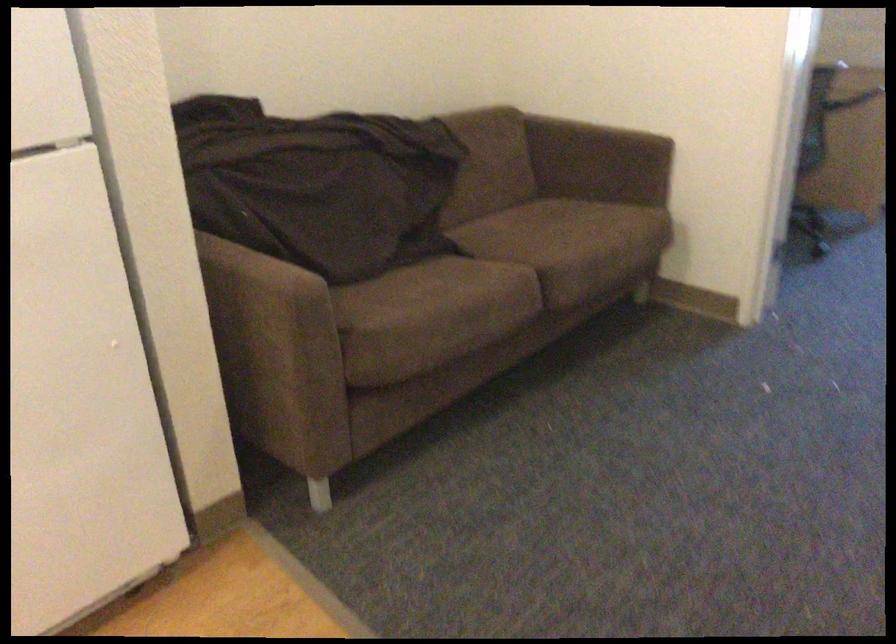
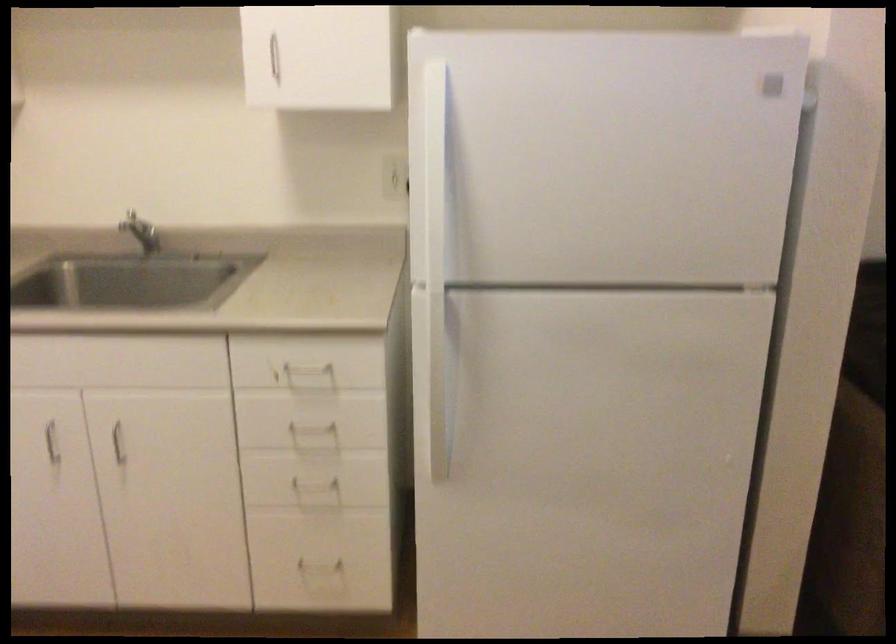
Question: The camera is either moving clockwise (left) or counter-clockwise (right) around the object. The first image is from the beginning of the video and the second image is from the end. Is the camera moving left or right when shooting the video?

Choices:
 (A) Left
 (B) Right

Answer: (B)